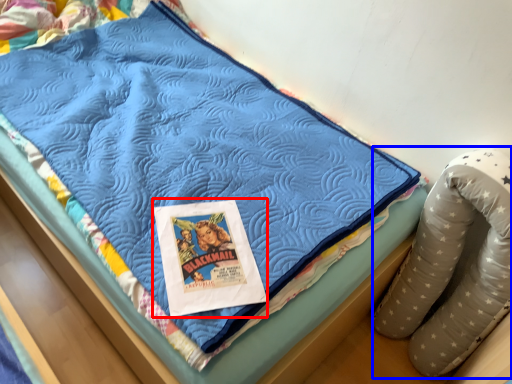
Question: Which of the following is the closest to the observer, comic book (highlighted by a red box) or bean bag chair (highlighted by a blue box)?

Choices:
 (A) comic book
 (B) bean bag chair

Answer: (B)